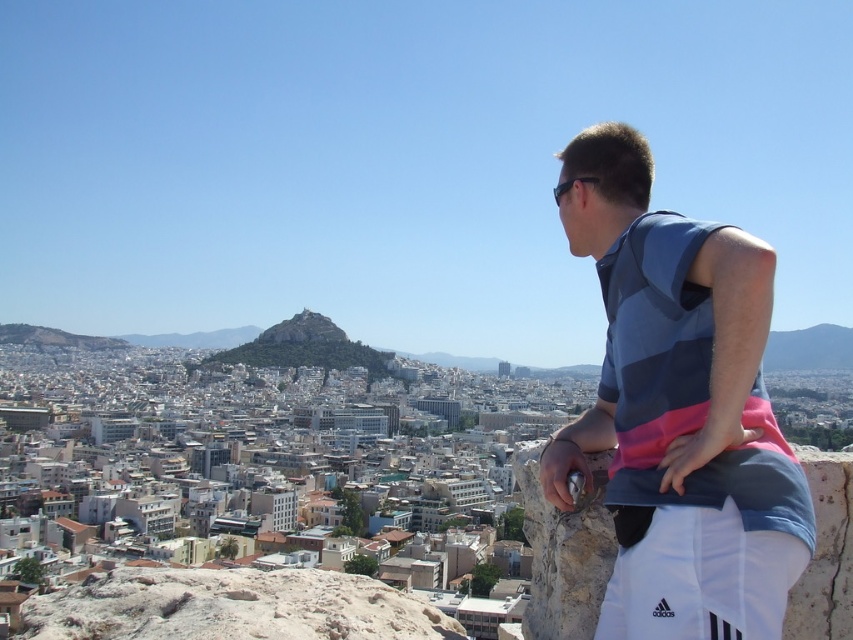
Question: Which point is farther to the camera?

Choices:
 (A) smooth stone peak at center
 (B) blue striped sleeveless shirt at right

Answer: (A)

Question: Where is blue striped sleeveless shirt at right located in relation to smooth stone peak at center in the image?

Choices:
 (A) right
 (B) left

Answer: (A)

Question: Where is blue striped sleeveless shirt at right located in relation to smooth stone peak at center in the image?

Choices:
 (A) left
 (B) right

Answer: (B)

Question: Which object appears farthest from the camera in this image?

Choices:
 (A) smooth stone peak at center
 (B) blue striped sleeveless shirt at right

Answer: (A)

Question: Observing the image, what is the correct spatial positioning of blue striped sleeveless shirt at right in reference to smooth stone peak at center?

Choices:
 (A) left
 (B) right

Answer: (B)